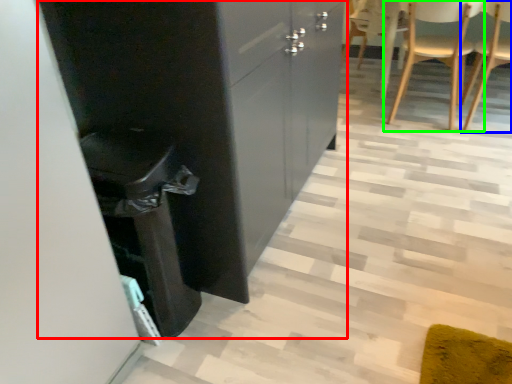
Question: Estimate the real-world distances between objects in this image. Which object is closer to cabinetry (highlighted by a red box), chair (highlighted by a blue box) or chair (highlighted by a green box)?

Choices:
 (A) chair
 (B) chair

Answer: (B)